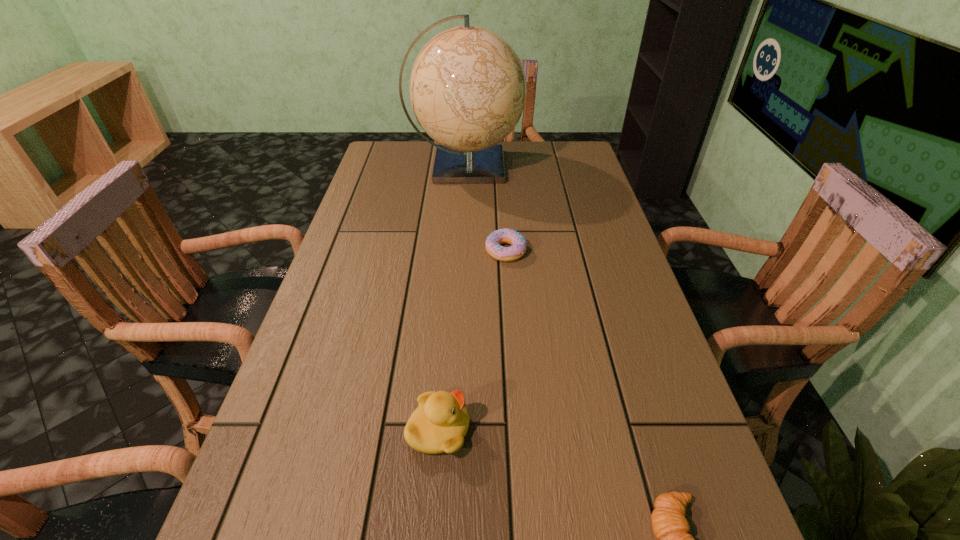
You are a GUI agent. You are given a task and a screenshot of the screen. Output one action in this format:
    pyautogui.click(x=<x>, y=<y>)
    Task: Click on the object positioned at the far left corner
    
    Given the screenshot: What is the action you would take?
    pyautogui.click(x=467, y=86)

Where is `blank space at the far edge of the desktop`? The image size is (960, 540). blank space at the far edge of the desktop is located at coordinates (429, 153).

The image size is (960, 540). I want to click on blank space at the left edge of the desktop, so click(x=382, y=191).

Where is `free spot at the right edge of the desktop`? This screenshot has width=960, height=540. free spot at the right edge of the desktop is located at coordinates (583, 299).

Where is `free space at the far right corner of the desktop`? free space at the far right corner of the desktop is located at coordinates (581, 152).

Identify the location of unoccupied area between the third shortest object and the tallest object. The width and height of the screenshot is (960, 540). (452, 298).

Identify the location of object that stands as the third closest to the farthest object. Image resolution: width=960 pixels, height=540 pixels. (670, 526).

Locate an element on the screen. This screenshot has height=540, width=960. object that can be found as the second closest to the globe is located at coordinates (439, 424).

The height and width of the screenshot is (540, 960). Identify the location of free spot that satisfies the following two spatial constraints: 1. on the surface of the tallest object showing Europe and Africa; 2. on the back side of the doughnut. (x=461, y=251).